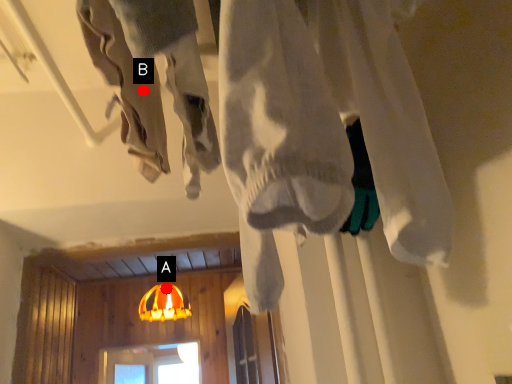
Question: Two points are circled on the image, labeled by A and B beside each circle. Which of the following is the farthest from the observer?

Choices:
 (A) A is further
 (B) B is further

Answer: (A)